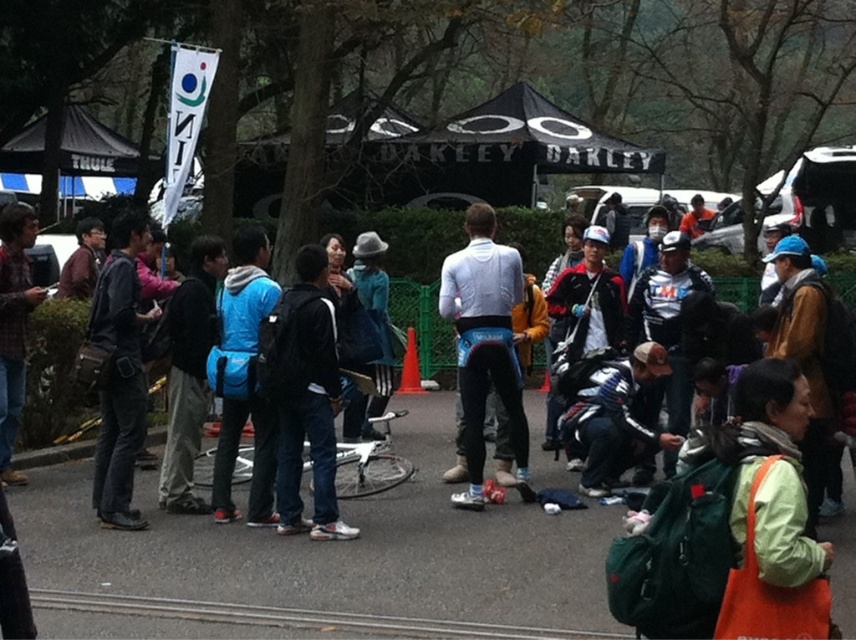
Question: Among these points, which one is farthest from the camera?

Choices:
 (A) (229, 604)
 (B) (473, 449)

Answer: (B)

Question: Observing the image, what is the correct spatial positioning of white matte cycling jersey at center in reference to black asphalt road at center?

Choices:
 (A) below
 (B) above

Answer: (B)

Question: Which point is farther to the camera?

Choices:
 (A) white matte cycling jersey at center
 (B) black asphalt road at center

Answer: (A)

Question: Can you confirm if white matte cycling jersey at center is smaller than black asphalt road at center?

Choices:
 (A) no
 (B) yes

Answer: (A)

Question: Can you confirm if white matte cycling jersey at center is smaller than black asphalt road at center?

Choices:
 (A) yes
 (B) no

Answer: (B)